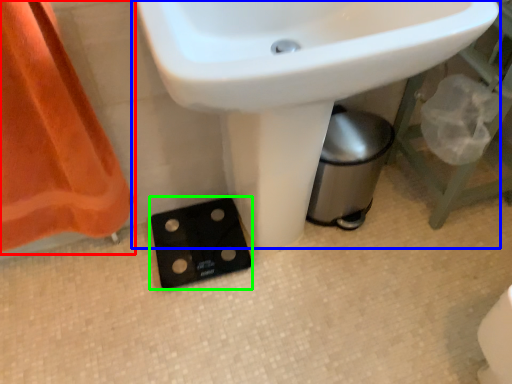
Question: Considering the real-world distances, which object is farthest from curtain (highlighted by a red box)? sink (highlighted by a blue box) or socket (highlighted by a green box)?

Choices:
 (A) sink
 (B) socket

Answer: (A)